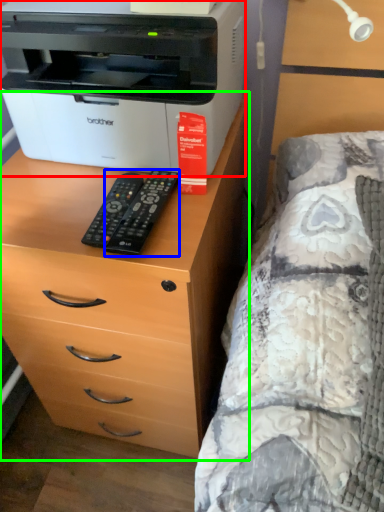
Question: Estimate the real-world distances between objects in this image. Which object is farther from printer (highlighted by a red box), remote (highlighted by a blue box) or chest of drawers (highlighted by a green box)?

Choices:
 (A) remote
 (B) chest of drawers

Answer: (B)